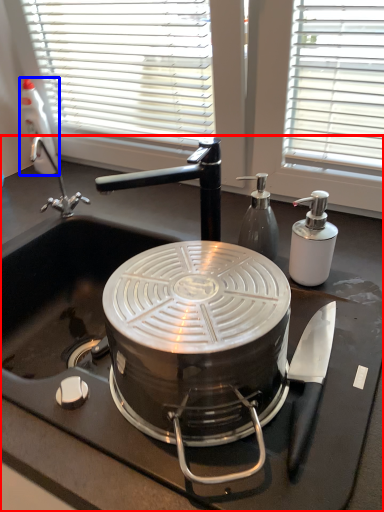
Question: Which point is closer to the camera, sink (highlighted by a red box) or bottle (highlighted by a blue box)?

Choices:
 (A) sink
 (B) bottle

Answer: (A)